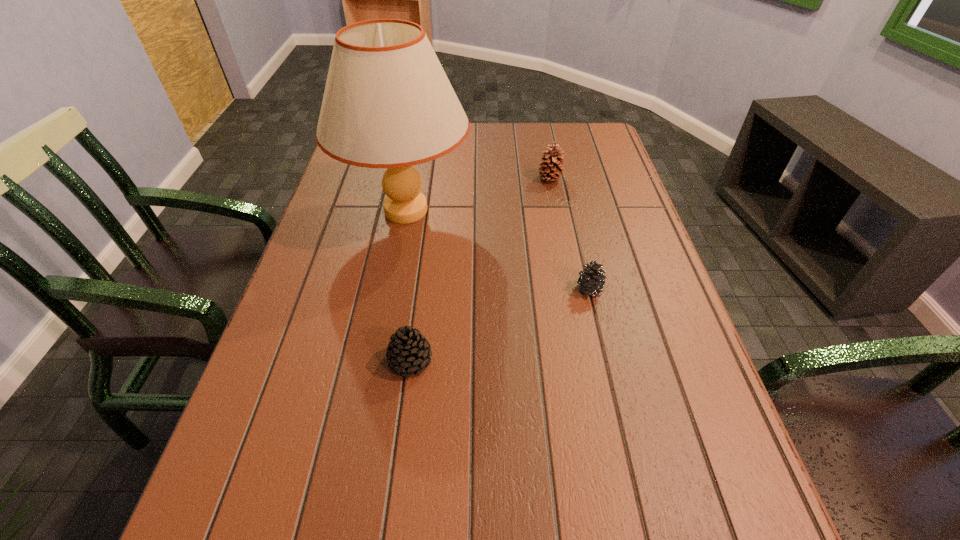
I want to click on vacant point located between the shortest object and the lampshade, so click(x=497, y=250).

Image resolution: width=960 pixels, height=540 pixels. What are the coordinates of `vacant space that is in between the tallest object and the tallest pinecone` in the screenshot? It's located at (478, 195).

This screenshot has width=960, height=540. Find the location of `free space between the farthest pinecone and the nearest object`. free space between the farthest pinecone and the nearest object is located at coordinates (480, 270).

The image size is (960, 540). Find the location of `free space between the second nearest pinecone and the lampshade`. free space between the second nearest pinecone and the lampshade is located at coordinates (497, 250).

What are the coordinates of `free space between the farthest pinecone and the nearest object` in the screenshot? It's located at (480, 270).

Image resolution: width=960 pixels, height=540 pixels. What are the coordinates of `blank region between the tallest object and the nearest pinecone` in the screenshot? It's located at (408, 286).

Locate an element on the screen. This screenshot has height=540, width=960. object that is the third closest to the nearest pinecone is located at coordinates (552, 168).

Locate which object ranks third in proximity to the leftmost pinecone. Please provide its 2D coordinates. Your answer should be formatted as a tuple, i.e. [(x, y)], where the tuple contains the x and y coordinates of a point satisfying the conditions above.

[(552, 168)]

Where is `pinecone that is the nearest to the lampshade`? This screenshot has width=960, height=540. pinecone that is the nearest to the lampshade is located at coordinates (552, 168).

Identify which pinecone is the second nearest to the third farthest object. Please provide its 2D coordinates. Your answer should be formatted as a tuple, i.e. [(x, y)], where the tuple contains the x and y coordinates of a point satisfying the conditions above.

[(552, 168)]